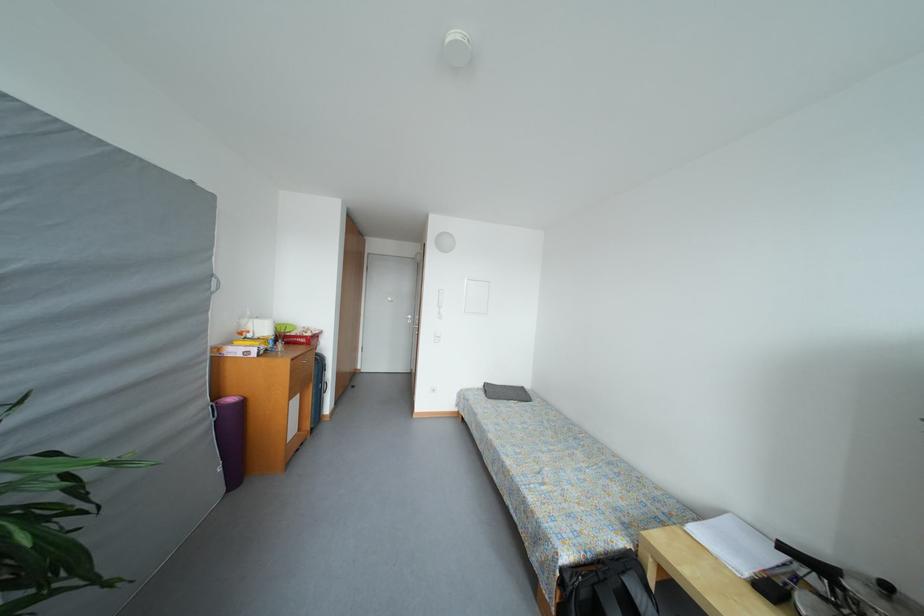
At what (x,y) coordinates should I click in order to perform the action: click on yellow cardboard box. Please return your answer as a coordinate pair (x, y). This screenshot has width=924, height=616. Looking at the image, I should click on (701, 575).